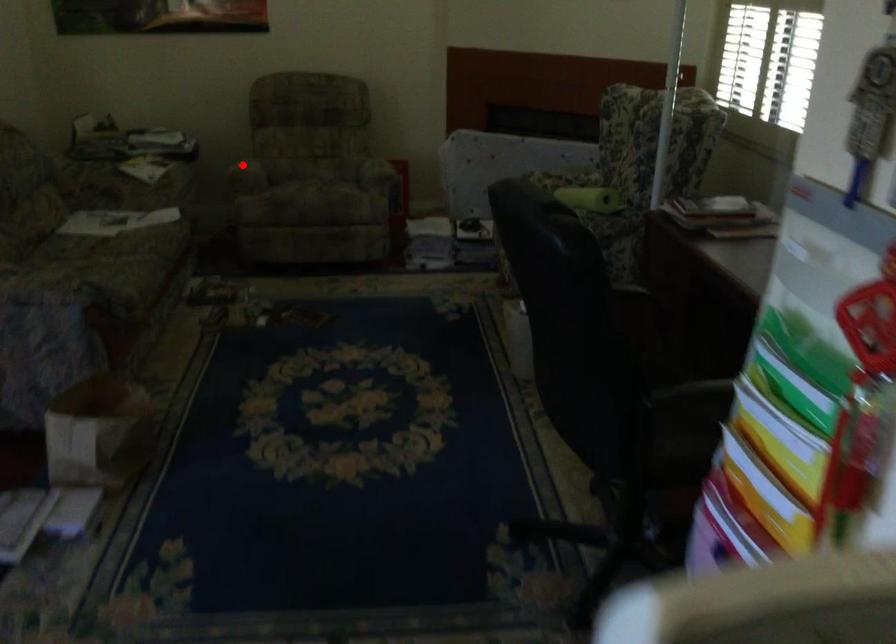
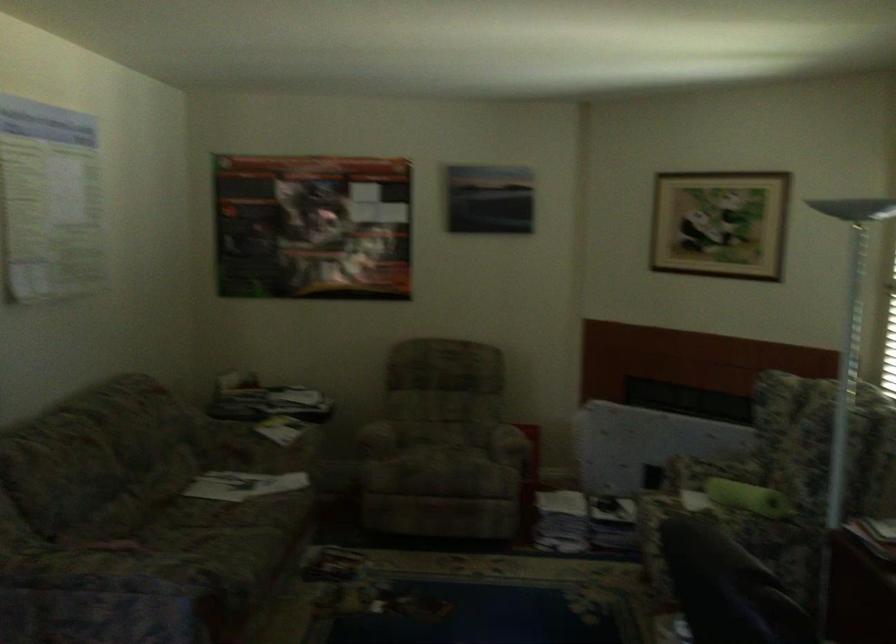
Where in the second image is the point corresponding to the highlighted location from the first image?

(377, 438)